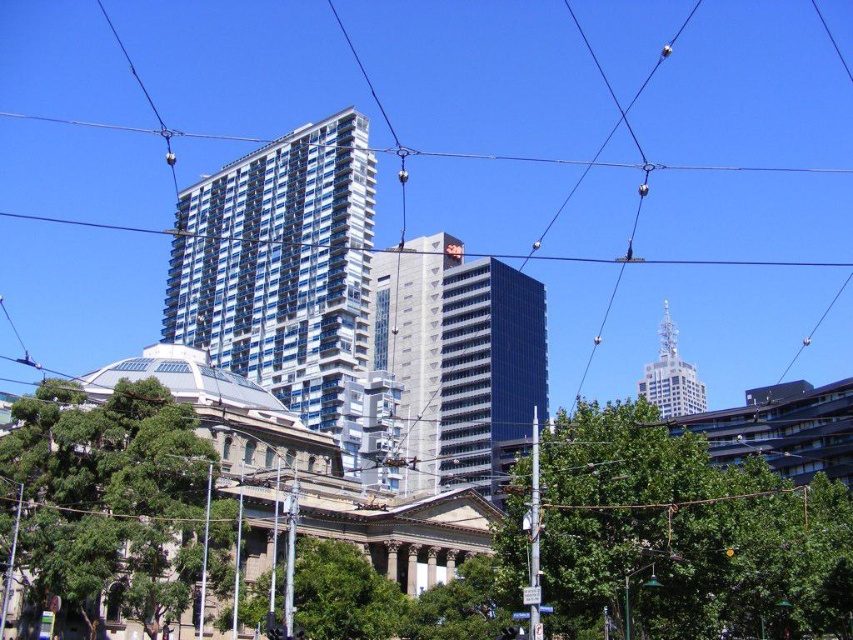
Who is positioned more to the left, green leafy tree at center or transparent glass power line at upper center?

transparent glass power line at upper center

Where is `green leafy tree at center`? green leafy tree at center is located at coordinates (343, 593).

At what (x,y) coordinates should I click in order to perform the action: click on green leafy tree at center. Please return your answer as a coordinate pair (x, y). The width and height of the screenshot is (853, 640). Looking at the image, I should click on tap(343, 593).

Is point (149, 428) closer to viewer compared to point (664, 260)?

Yes.

Who is more distant from viewer, (125, 545) or (697, 260)?

Positioned behind is point (697, 260).

This screenshot has height=640, width=853. What are the coordinates of `green leafy tree at lower left` in the screenshot? It's located at pyautogui.click(x=106, y=499).

Is green leafy tree at lower center taller than glassy blue building at center?

No, green leafy tree at lower center is not taller than glassy blue building at center.

Between point (689, 436) and point (291, 156), which one is positioned in front?

Point (689, 436) is in front.

Where is `green leafy tree at lower center`? green leafy tree at lower center is located at coordinates (685, 536).